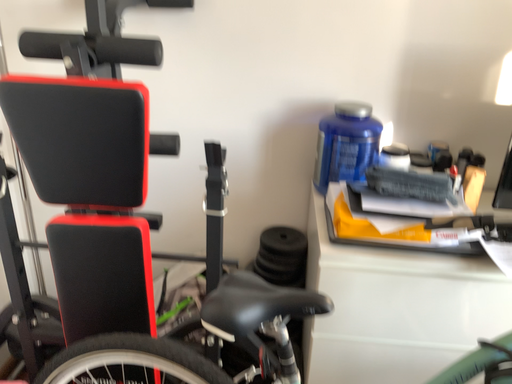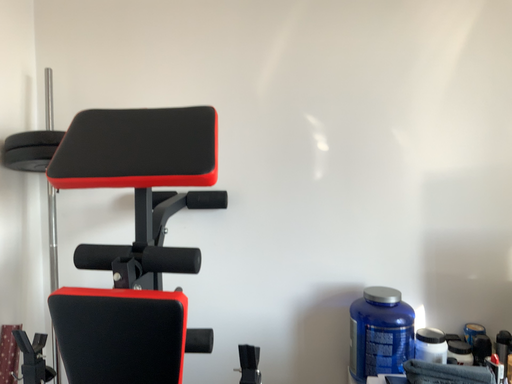
Question: Which way did the camera rotate in the video?

Choices:
 (A) rotated upward
 (B) rotated downward

Answer: (A)